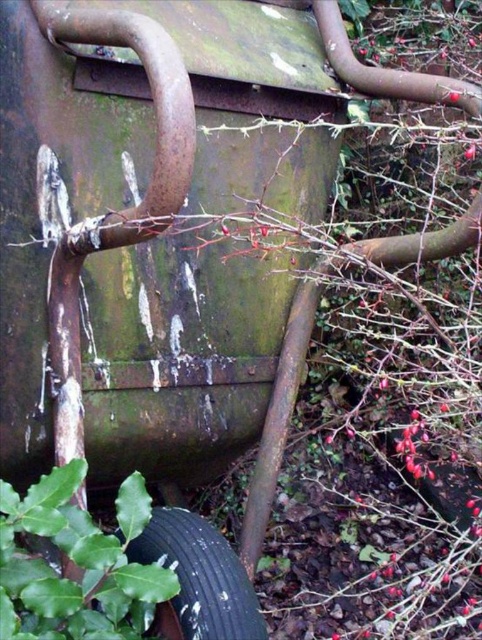
Is green leafy plant at lower left above black rubber tire at lower left?

Correct, green leafy plant at lower left is located above black rubber tire at lower left.

Can you confirm if green leafy plant at lower left is positioned to the right of black rubber tire at lower left?

No, green leafy plant at lower left is not to the right of black rubber tire at lower left.

Locate an element on the screen. green leafy plant at lower left is located at coordinates (76, 563).